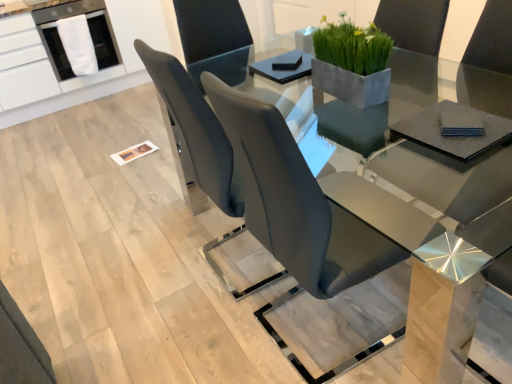
In order to face white glossy dishwasher at upper left, should I rotate leftwards or rightwards?

Rotate your view left by about 22.857°.

What do you see at coordinates (78, 45) in the screenshot? This screenshot has height=384, width=512. I see `white fabric at upper left` at bounding box center [78, 45].

From the picture: Measure the distance between point (82, 69) and camera.

They are 12.55 feet apart.

Measure the distance between point (195, 141) and camera.

4.68 feet.

Where is `white glossy dishwasher at upper left`? The width and height of the screenshot is (512, 384). white glossy dishwasher at upper left is located at coordinates (89, 30).

Are white fabric at upper left and white glossy dishwasher at upper left located far from each other?

No, there isn't a large distance between white fabric at upper left and white glossy dishwasher at upper left.

I want to click on dish washer above the white fabric at upper left (from the image's perspective), so click(x=89, y=30).

Is white fabric at upper left further to the viewer compared to white glossy dishwasher at upper left?

Yes.

Consider the image. Is matte gray chair at center, which is the second chair in left-to-right order, far from white glossy dishwasher at upper left?

Absolutely, matte gray chair at center, which is the second chair in left-to-right order, is distant from white glossy dishwasher at upper left.

How many degrees apart are the facing directions of matte gray chair at center, positioned as the 1th chair in right-to-left order, and white glossy dishwasher at upper left?

The angular difference between matte gray chair at center, positioned as the 1th chair in right-to-left order, and white glossy dishwasher at upper left is 88.3 degrees.

Can you confirm if matte gray chair at center, positioned as the 1th chair in right-to-left order, is positioned to the right of white glossy dishwasher at upper left?

Correct, you'll find matte gray chair at center, positioned as the 1th chair in right-to-left order, to the right of white glossy dishwasher at upper left.

From a real-world perspective, which is physically above, matte gray chair at center, which is the second chair in left-to-right order, or white glossy dishwasher at upper left?

white glossy dishwasher at upper left.

From a real-world perspective, is matte gray chair at center, the 2th chair when ordered from right to left, over white fabric at upper left?

Yes, from a real-world perspective, matte gray chair at center, the 2th chair when ordered from right to left, is over white fabric at upper left

Is matte gray chair at center, marked as the first chair in a left-to-right arrangement, facing away from white fabric at upper left?

matte gray chair at center, marked as the first chair in a left-to-right arrangement, is not turned away from white fabric at upper left.

Which of these two, matte gray chair at center, marked as the first chair in a left-to-right arrangement, or white fabric at upper left, is wider?

matte gray chair at center, marked as the first chair in a left-to-right arrangement.

From a real-world perspective, which object rests below the other?

From a 3D spatial view, matte gray chair at center, which is the second chair in left-to-right order, is below.

Which is in front, point (295, 263) or point (361, 104)?

The point (295, 263) is more forward.

From the picture: Can you confirm if matte gray chair at center, positioned as the 1th chair in right-to-left order, is positioned to the left of green matte concrete planter at upper center?

Correct, you'll find matte gray chair at center, positioned as the 1th chair in right-to-left order, to the left of green matte concrete planter at upper center.

Could you tell me if matte gray chair at center, positioned as the 1th chair in right-to-left order, is facing green matte concrete planter at upper center?

No, matte gray chair at center, positioned as the 1th chair in right-to-left order, does not turn towards green matte concrete planter at upper center.

Does matte gray chair at center, the 2th chair when ordered from right to left, turn towards white glossy dishwasher at upper left?

No, matte gray chair at center, the 2th chair when ordered from right to left, is not facing towards white glossy dishwasher at upper left.

From a real-world perspective, is matte gray chair at center, marked as the first chair in a left-to-right arrangement, physically located above or below white glossy dishwasher at upper left?

Clearly, from a real-world perspective, matte gray chair at center, marked as the first chair in a left-to-right arrangement, is below white glossy dishwasher at upper left.

In terms of width, does matte gray chair at center, the 2th chair when ordered from right to left, look wider or thinner when compared to white glossy dishwasher at upper left?

Considering their sizes, matte gray chair at center, the 2th chair when ordered from right to left, looks slimmer than white glossy dishwasher at upper left.

Between matte gray chair at center, the 2th chair when ordered from right to left, and white glossy dishwasher at upper left, which one has less height?

With less height is white glossy dishwasher at upper left.

From the image's perspective, would you say green matte concrete planter at upper center is positioned over matte gray chair at center, marked as the first chair in a left-to-right arrangement?

Yes.

You are a GUI agent. You are given a task and a screenshot of the screen. Output one action in this format:
    pyautogui.click(x=<x>, y=<y>)
    Task: Click on the houseplant above the matte gray chair at center, the 2th chair when ordered from right to left (from a real-world perspective)
    The height and width of the screenshot is (384, 512).
    Given the screenshot: What is the action you would take?
    pyautogui.click(x=352, y=62)

Considering the relative sizes of green matte concrete planter at upper center and matte gray chair at center, marked as the first chair in a left-to-right arrangement, in the image provided, is green matte concrete planter at upper center bigger than matte gray chair at center, marked as the first chair in a left-to-right arrangement,?

No, green matte concrete planter at upper center is not bigger than matte gray chair at center, marked as the first chair in a left-to-right arrangement.

Is the depth of green matte concrete planter at upper center less than that of matte gray chair at center, the 2th chair when ordered from right to left?

No, it is behind matte gray chair at center, the 2th chair when ordered from right to left.

Is matte gray chair at center, the 2th chair when ordered from right to left, far from green matte concrete planter at upper center?

They are positioned close to each other.

Could green matte concrete planter at upper center be considered to be inside matte gray chair at center, the 2th chair when ordered from right to left?

Actually, green matte concrete planter at upper center is outside matte gray chair at center, the 2th chair when ordered from right to left.

From a real-world perspective, which object stands above the other?

green matte concrete planter at upper center.

Considering the relative positions of matte gray chair at center, marked as the first chair in a left-to-right arrangement, and green matte concrete planter at upper center in the image provided, is matte gray chair at center, marked as the first chair in a left-to-right arrangement, to the right of green matte concrete planter at upper center from the viewer's perspective?

Incorrect, matte gray chair at center, marked as the first chair in a left-to-right arrangement, is not on the right side of green matte concrete planter at upper center.

The image size is (512, 384). Identify the location of dish washer on the left of the white fabric at upper left. (89, 30).

There is a matte gray chair at center, positioned as the 1th chair in right-to-left order. Identify the location of dish washer above it (from a real-world perspective). The height and width of the screenshot is (384, 512). (89, 30).

In the scene shown: When comparing their distances from white glossy dishwasher at upper left, does matte gray chair at center, positioned as the 1th chair in right-to-left order, or white fabric at upper left seem further?

The object further to white glossy dishwasher at upper left is matte gray chair at center, positioned as the 1th chair in right-to-left order.

Considering their positions, is matte gray chair at center, marked as the first chair in a left-to-right arrangement, positioned closer to matte gray chair at center, positioned as the 1th chair in right-to-left order, than white glossy dishwasher at upper left?

Based on the image, matte gray chair at center, marked as the first chair in a left-to-right arrangement, appears to be nearer to matte gray chair at center, positioned as the 1th chair in right-to-left order.

When comparing their distances from green matte concrete planter at upper center, does white glossy dishwasher at upper left or matte gray chair at center, marked as the first chair in a left-to-right arrangement, seem further?

The object further to green matte concrete planter at upper center is white glossy dishwasher at upper left.

Considering their positions, is matte gray chair at center, which is the second chair in left-to-right order, positioned further to white glossy dishwasher at upper left than green matte concrete planter at upper center?

matte gray chair at center, which is the second chair in left-to-right order, is positioned further to the anchor white glossy dishwasher at upper left.

From the image, which object appears to be nearer to white fabric at upper left, matte gray chair at center, marked as the first chair in a left-to-right arrangement, or matte gray chair at center, which is the second chair in left-to-right order?

Among the two, matte gray chair at center, marked as the first chair in a left-to-right arrangement, is located nearer to white fabric at upper left.

Looking at the image, which one is located closer to green matte concrete planter at upper center, matte gray chair at center, marked as the first chair in a left-to-right arrangement, or matte gray chair at center, which is the second chair in left-to-right order?

matte gray chair at center, marked as the first chair in a left-to-right arrangement, is positioned closer to the anchor green matte concrete planter at upper center.

Considering their positions, is white fabric at upper left positioned closer to white glossy dishwasher at upper left than green matte concrete planter at upper center?

white fabric at upper left.

Based on the photo, which object lies further to the anchor point matte gray chair at center, positioned as the 1th chair in right-to-left order, white glossy dishwasher at upper left or white fabric at upper left?

The object further to matte gray chair at center, positioned as the 1th chair in right-to-left order, is white glossy dishwasher at upper left.

Identify the location of chair positioned between matte gray chair at center, which is the second chair in left-to-right order, and white glossy dishwasher at upper left from near to far. (196, 130).

Locate an element on the screen. dish washer positioned between matte gray chair at center, marked as the first chair in a left-to-right arrangement, and white fabric at upper left from near to far is located at coordinates (89, 30).

Where is `houseplant between matte gray chair at center, marked as the first chair in a left-to-right arrangement, and white fabric at upper left in the front-back direction`? This screenshot has width=512, height=384. houseplant between matte gray chair at center, marked as the first chair in a left-to-right arrangement, and white fabric at upper left in the front-back direction is located at coordinates (352, 62).

Where is `houseplant between matte gray chair at center, which is the second chair in left-to-right order, and white fabric at upper left from front to back`? houseplant between matte gray chair at center, which is the second chair in left-to-right order, and white fabric at upper left from front to back is located at coordinates (352, 62).